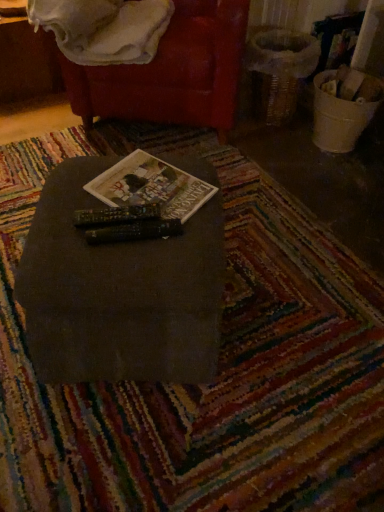
What do you see at coordinates (172, 72) in the screenshot?
I see `velvet red bean bag chair at upper center` at bounding box center [172, 72].

What do you see at coordinates (119, 292) in the screenshot? I see `matte black table at center` at bounding box center [119, 292].

The width and height of the screenshot is (384, 512). I want to click on hardcover book at center, so click(151, 186).

In the scene shown: Measure the distance between white soft blanket at upper left and camera.

They are 1.55 meters apart.

At what (x,y) coordinates should I click in order to perform the action: click on velvet red bean bag chair at upper center. Please return your answer as a coordinate pair (x, y). Looking at the image, I should click on tap(172, 72).

Considering the relative positions of hardcover book at center and velvet red bean bag chair at upper center in the image provided, is hardcover book at center in front of velvet red bean bag chair at upper center?

Yes, hardcover book at center is in front of velvet red bean bag chair at upper center.

Is hardcover book at center oriented away from velvet red bean bag chair at upper center?

No, hardcover book at center is not facing the opposite direction of velvet red bean bag chair at upper center.

Considering the relative positions of hardcover book at center and velvet red bean bag chair at upper center in the image provided, is hardcover book at center to the left of velvet red bean bag chair at upper center from the viewer's perspective?

Incorrect, hardcover book at center is not on the left side of velvet red bean bag chair at upper center.

From a real-world perspective, who is located lower, hardcover book at center or velvet red bean bag chair at upper center?

velvet red bean bag chair at upper center.

From the image's perspective, is white soft blanket at upper left below matte black table at center?

Incorrect, from the image's perspective, white soft blanket at upper left is higher than matte black table at center.

Considering the positions of objects white soft blanket at upper left and matte black table at center in the image provided, who is in front, white soft blanket at upper left or matte black table at center?

matte black table at center is closer to the camera.

Is white soft blanket at upper left aimed at matte black table at center?

Yes, white soft blanket at upper left is aimed at matte black table at center.

Is point (184, 59) behind point (47, 27)?

That is True.

From the image's perspective, is velvet red bean bag chair at upper center positioned above or below white soft blanket at upper left?

Based on their image positions, velvet red bean bag chair at upper center is located above white soft blanket at upper left.

In order to click on bean bag chair lying behind the white soft blanket at upper left in this screenshot , I will do `click(172, 72)`.

Can you tell me how much white soft blanket at upper left and velvet red bean bag chair at upper center differ in facing direction?

They differ by 2.74 degrees in their facing directions.

Is point (154, 26) positioned before point (198, 115)?

Yes.

Who is taller, white soft blanket at upper left or velvet red bean bag chair at upper center?

With more height is velvet red bean bag chair at upper center.

Is white soft blanket at upper left further to camera compared to velvet red bean bag chair at upper center?

No, white soft blanket at upper left is closer to the viewer.

Does matte black table at center have a lesser height compared to white soft blanket at upper left?

No, matte black table at center is not shorter than white soft blanket at upper left.

You are a GUI agent. You are given a task and a screenshot of the screen. Output one action in this format:
    pyautogui.click(x=<x>, y=<y>)
    Task: Click on the table below the white soft blanket at upper left (from the image's perspective)
    
    Given the screenshot: What is the action you would take?
    pyautogui.click(x=119, y=292)

Is matte black table at center looking in the opposite direction of white soft blanket at upper left?

No.

Which is more to the right, matte black table at center or white soft blanket at upper left?

From the viewer's perspective, matte black table at center appears more on the right side.

Is matte black table at center positioned far away from hardcover book at center?

No, matte black table at center is in close proximity to hardcover book at center.

How many degrees apart are the facing directions of matte black table at center and hardcover book at center?

matte black table at center and hardcover book at center are facing 52.9 degrees away from each other.

From a real-world perspective, is matte black table at center above or below hardcover book at center?

In terms of real-world spatial position, matte black table at center is below hardcover book at center.

Is matte black table at center facing towards hardcover book at center?

No, matte black table at center is not oriented towards hardcover book at center.

From the image's perspective, is hardcover book at center positioned above or below white soft blanket at upper left?

hardcover book at center is situated lower than white soft blanket at upper left in the image.

Which of these two, hardcover book at center or white soft blanket at upper left, stands shorter?

hardcover book at center is shorter.

Is hardcover book at center not within white soft blanket at upper left?

hardcover book at center lies outside white soft blanket at upper left's area.

This screenshot has width=384, height=512. I want to click on bean bag chair to the left of hardcover book at center, so click(172, 72).

Identify the location of blanket behind the matte black table at center. (103, 28).

Looking at this image, considering their positions, is hardcover book at center positioned closer to velvet red bean bag chair at upper center than white soft blanket at upper left?

Among the two, white soft blanket at upper left is located nearer to velvet red bean bag chair at upper center.

Estimate the real-world distances between objects in this image. Which object is further from matte black table at center, hardcover book at center or velvet red bean bag chair at upper center?

velvet red bean bag chair at upper center is further to matte black table at center.

From the image, which object appears to be nearer to matte black table at center, hardcover book at center or white soft blanket at upper left?

hardcover book at center lies closer to matte black table at center than the other object.

From the picture: Estimate the real-world distances between objects in this image. Which object is closer to white soft blanket at upper left, hardcover book at center or matte black table at center?

The object closer to white soft blanket at upper left is hardcover book at center.

When comparing their distances from hardcover book at center, does matte black table at center or velvet red bean bag chair at upper center seem closer?

Based on the image, matte black table at center appears to be nearer to hardcover book at center.

When comparing their distances from hardcover book at center, does matte black table at center or white soft blanket at upper left seem closer?

Based on the image, matte black table at center appears to be nearer to hardcover book at center.

Considering their positions, is velvet red bean bag chair at upper center positioned further to hardcover book at center than white soft blanket at upper left?

velvet red bean bag chair at upper center lies further to hardcover book at center than the other object.

Based on their spatial positions, is matte black table at center or white soft blanket at upper left further from velvet red bean bag chair at upper center?

matte black table at center is further to velvet red bean bag chair at upper center.

At what (x,y) coordinates should I click in order to perform the action: click on blanket that lies between velvet red bean bag chair at upper center and matte black table at center from top to bottom. Please return your answer as a coordinate pair (x, y). Looking at the image, I should click on (103, 28).

This screenshot has width=384, height=512. What are the coordinates of `paperback book that lies between velvet red bean bag chair at upper center and matte black table at center from top to bottom` in the screenshot? It's located at (151, 186).

Identify the location of blanket that lies between velvet red bean bag chair at upper center and hardcover book at center from top to bottom. (103, 28).

Locate an element on the screen. This screenshot has width=384, height=512. paperback book between white soft blanket at upper left and matte black table at center in the up-down direction is located at coordinates (151, 186).